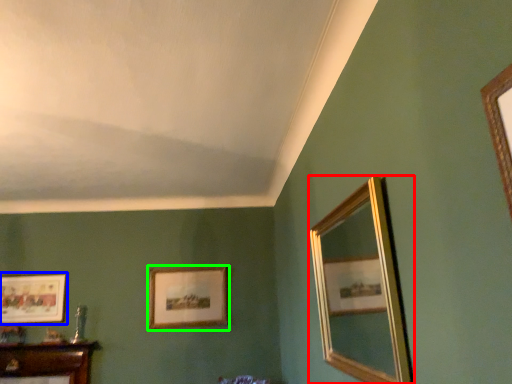
Question: Which object is the farthest from mirror (highlighted by a red box)? Choose among these: picture frame (highlighted by a blue box) or picture frame (highlighted by a green box).

Choices:
 (A) picture frame
 (B) picture frame

Answer: (A)